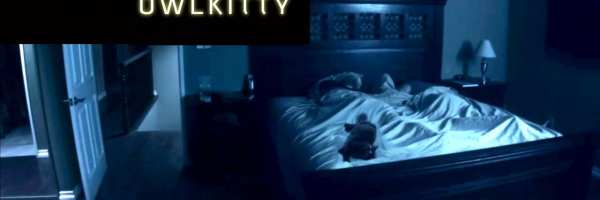
The image size is (600, 200). I want to click on space above lamp, so click(x=490, y=23).